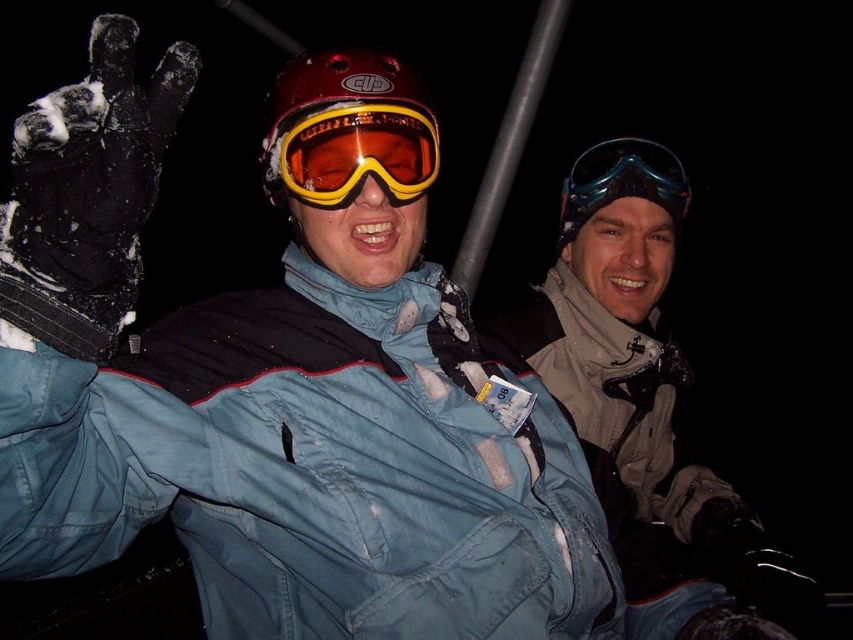
Question: Which of these objects is positioned closest to the transparent blue goggles at upper center?

Choices:
 (A) matte gray jacket at center
 (B) yellow matte/glossy goggles at center

Answer: (A)

Question: Is matte gray jacket at center wider than yellow matte/glossy goggles at center?

Choices:
 (A) yes
 (B) no

Answer: (A)

Question: Is the position of matte gray jacket at center less distant than that of transparent blue goggles at upper center?

Choices:
 (A) no
 (B) yes

Answer: (B)

Question: Does yellow matte/glossy goggles at center have a lesser width compared to transparent blue goggles at upper center?

Choices:
 (A) no
 (B) yes

Answer: (B)

Question: Which object is farther from the camera taking this photo?

Choices:
 (A) transparent blue goggles at upper center
 (B) yellow matte/glossy goggles at center

Answer: (A)

Question: Which object appears farthest from the camera in this image?

Choices:
 (A) yellow matte/glossy goggles at center
 (B) matte gray jacket at center

Answer: (B)